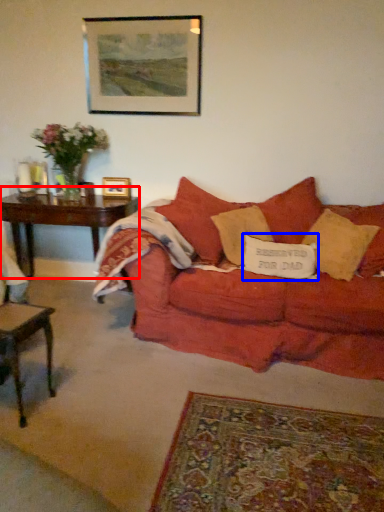
Question: Which point is closer to the camera, table (highlighted by a red box) or pillow (highlighted by a blue box)?

Choices:
 (A) table
 (B) pillow

Answer: (B)